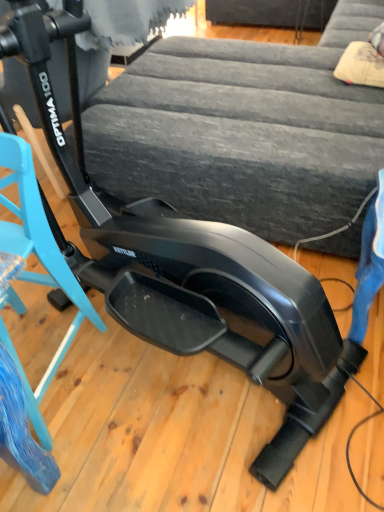
The height and width of the screenshot is (512, 384). Describe the element at coordinates (41, 263) in the screenshot. I see `blue painted wood chair at left` at that location.

Image resolution: width=384 pixels, height=512 pixels. Find the location of `blue painted wood chair at left`. blue painted wood chair at left is located at coordinates (41, 263).

Locate an element on the screen. blue painted wood chair at left is located at coordinates (41, 263).